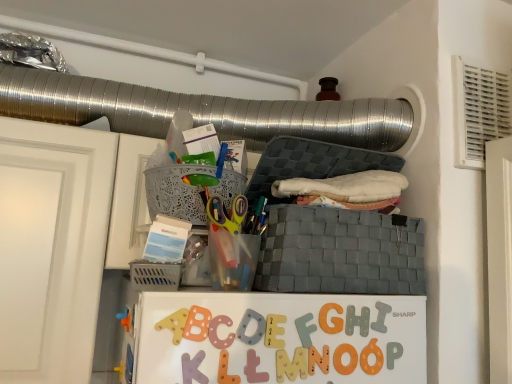
Question: Considering their positions, is gray woven basket at center, the first basket in the right-to-left sequence, located in front of or behind gray matte letter i at center, placed as the first alphabet when sorted from right to left?

Choices:
 (A) behind
 (B) front

Answer: (B)

Question: From a real-world perspective, is gray woven basket at center, placed as the second basket when sorted from left to right, above or below gray matte letter i at center, placed as the first alphabet when sorted from right to left?

Choices:
 (A) above
 (B) below

Answer: (A)

Question: Which object is positioned closest to the matte plastic letter m at center, acting as the 3th alphabet starting from the left?

Choices:
 (A) matte plastic letter l at center, the sixth alphabet positioned from the right
 (B) matte plastic letter e at center, the second alphabet viewed from the left
 (C) gray woven basket at center, placed as the second basket when sorted from left to right
 (D) gray foam letter f at center, positioned as the 4th alphabet in left-to-right order
 (E) gray matte letter i at center, placed as the first alphabet when sorted from right to left

Answer: (B)

Question: Estimate the real-world distances between objects in this image. Which object is farther from the orange matte letter at center, the first letter positioned from the bottom?

Choices:
 (A) gray matte letter i at center, the 6th alphabet in the left-to-right sequence
 (B) matte plastic letter e at center, the second alphabet viewed from the left
 (C) matte plastic letter l at center, the sixth alphabet positioned from the right
 (D) orange foam letter g at center, the 2th letter positioned from the bottom
 (E) wooden letter n at center, which ranks as the 5th alphabet in left-to-right order

Answer: (C)